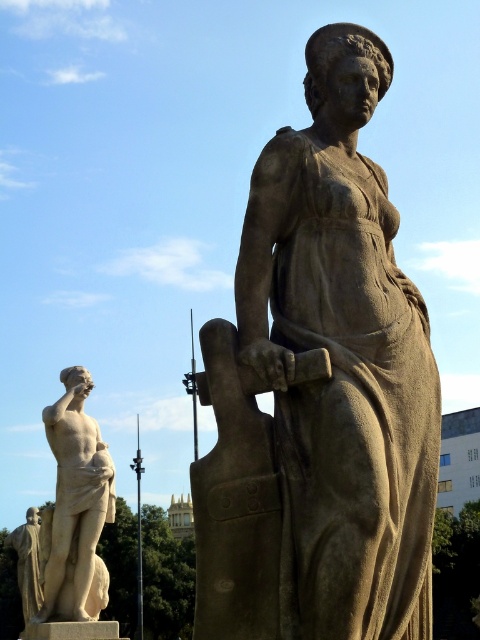
You are an art conservator assessing the placement of two statues in a garden. You see the matte stone statue at center and the white marble statue at left. Which statue is closer to you?

The matte stone statue at center is closer to you because it is positioned over the white marble statue at left, indicating it is in front.

You are an art conservator assessing the statues in the image. The matte stone statue at center and the white marble statue at left are both in need of restoration. If you have limited materials, which statue would require more resources based on their size?

The matte stone statue at center is bigger than the white marble statue at left, so it would require more resources for restoration.

You are standing in front of the two stone statues and want to take a photo. You notice two specific points in the image labeled as point 1 at coordinates point (x=391, y=589) and point 2 at coordinates point (x=58, y=426). Which point will appear larger in your photo?

Point 1 at coordinates point (x=391, y=589) will appear larger in the photo because it is closer to the camera than point 2 at coordinates point (x=58, y=426).